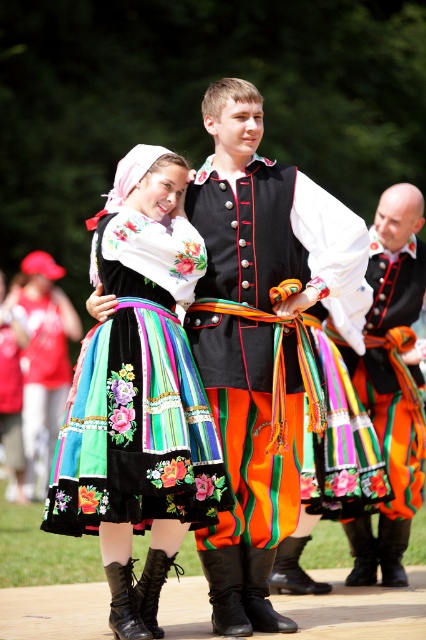
Does velvet black vest at center have a lesser width compared to matte black vest at center?

In fact, velvet black vest at center might be wider than matte black vest at center.

In the scene shown: Can you confirm if velvet black vest at center is smaller than matte black vest at center?

No, velvet black vest at center is not smaller than matte black vest at center.

Is point (296, 404) behind point (414, 429)?

No, (296, 404) is in front of (414, 429).

At what (x,y) coordinates should I click in order to perform the action: click on velvet black vest at center. Please return your answer as a coordinate pair (x, y). The image size is (426, 640). Looking at the image, I should click on (265, 216).

Based on the photo, which is more to the left, embroidered fabric dress at center or velvet black vest at center?

embroidered fabric dress at center is more to the left.

Who is more distant from viewer, [48,488] or [229,176]?

Point [229,176]

Who is more distant from viewer, [157,467] or [293,509]?

The point [293,509] is behind.

The width and height of the screenshot is (426, 640). Find the location of `embroidered fabric dress at center`. embroidered fabric dress at center is located at coordinates (138, 396).

How much distance is there between embroidered fabric dress at center and matte black vest at center?

They are 2.74 meters apart.

Can you confirm if embroidered fabric dress at center is shorter than matte black vest at center?

Correct, embroidered fabric dress at center is not as tall as matte black vest at center.

Does point (149, 236) lie in front of point (365, 376)?

Yes.

Identify the location of embroidered fabric dress at center. (138, 396).